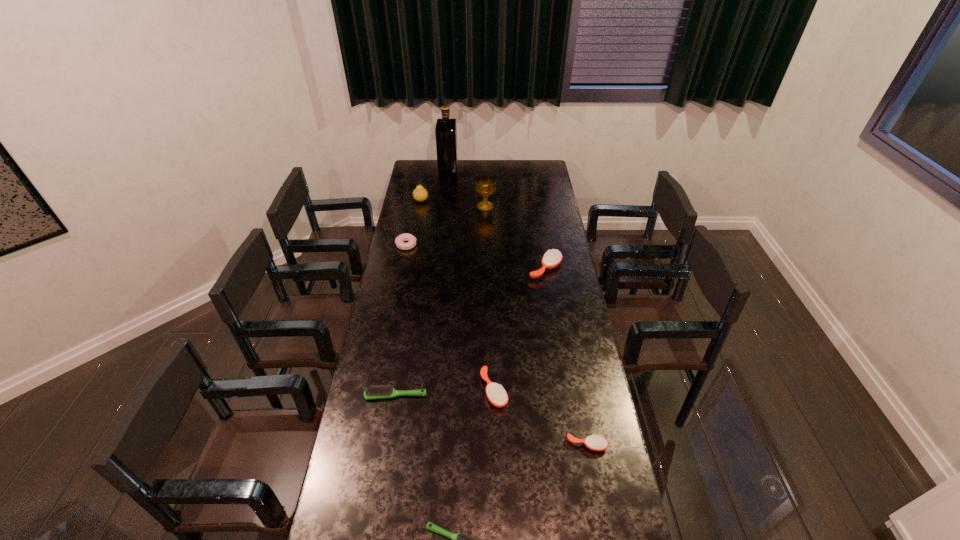
You are a GUI agent. You are given a task and a screenshot of the screen. Output one action in this format:
    pyautogui.click(x=<x>, y=<y>)
    Task: Click on the hairbrush object that ranks as the closest to the pear
    This screenshot has height=540, width=960.
    Given the screenshot: What is the action you would take?
    pyautogui.click(x=552, y=258)

Identify which orange hairbrush is located as the third nearest to the chalice. Please provide its 2D coordinates. Your answer should be formatted as a tuple, i.e. [(x, y)], where the tuple contains the x and y coordinates of a point satisfying the conditions above.

[(594, 442)]

Select which orange hairbrush appears as the third closest to the second tallest object. Please provide its 2D coordinates. Your answer should be formatted as a tuple, i.e. [(x, y)], where the tuple contains the x and y coordinates of a point satisfying the conditions above.

[(594, 442)]

Identify the location of light hairbrush that is the second nearest to the leftmost orange hairbrush. This screenshot has height=540, width=960. (459, 539).

Identify which light hairbrush is located as the second nearest to the farthest hairbrush. Please provide its 2D coordinates. Your answer should be formatted as a tuple, i.e. [(x, y)], where the tuple contains the x and y coordinates of a point satisfying the conditions above.

[(459, 539)]

Locate an element on the screen. Image resolution: width=960 pixels, height=540 pixels. free space in the image that satisfies the following two spatial constraints: 1. on the front label of the tallest object; 2. on the front side of the left light hairbrush is located at coordinates (424, 395).

In order to click on free space that satisfies the following two spatial constraints: 1. on the front label of the sixth shortest object; 2. on the left side of the farthest object in this screenshot , I will do `click(438, 268)`.

Locate an element on the screen. vacant region that satisfies the following two spatial constraints: 1. on the front label of the tallest object; 2. on the front side of the bigger light hairbrush is located at coordinates (424, 395).